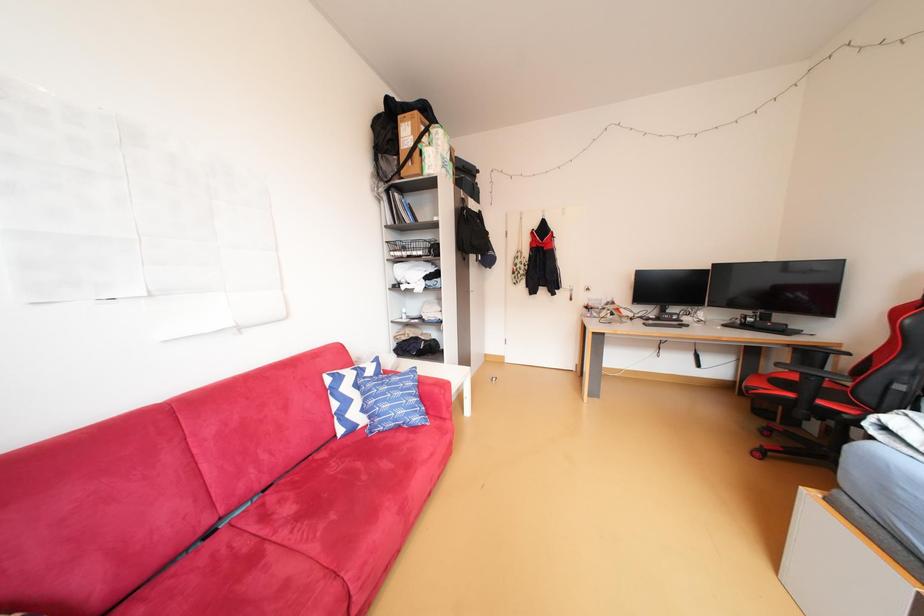
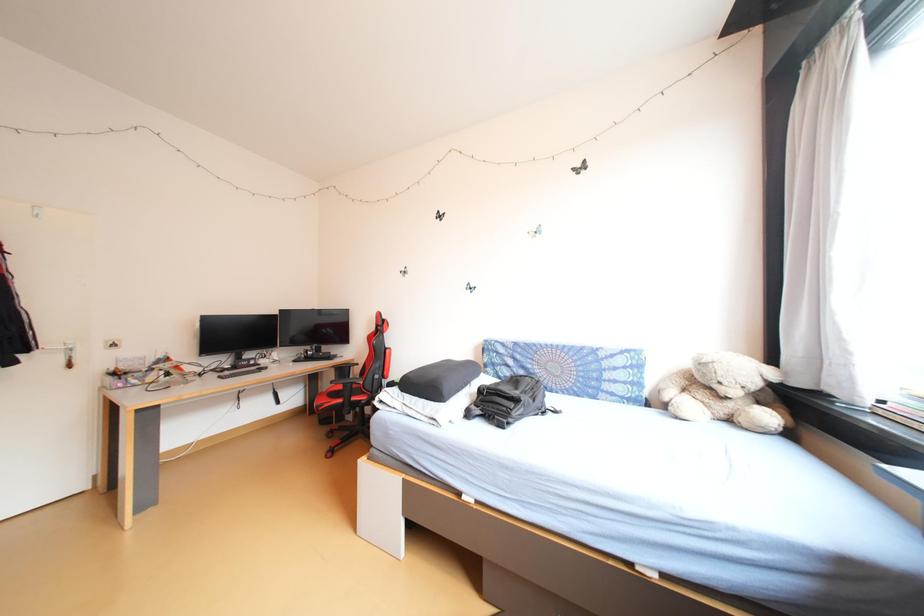
Question: The camera is either moving clockwise (left) or counter-clockwise (right) around the object. The first image is from the beginning of the video and the second image is from the end. Is the camera moving left or right when shooting the video?

Choices:
 (A) Left
 (B) Right

Answer: (A)